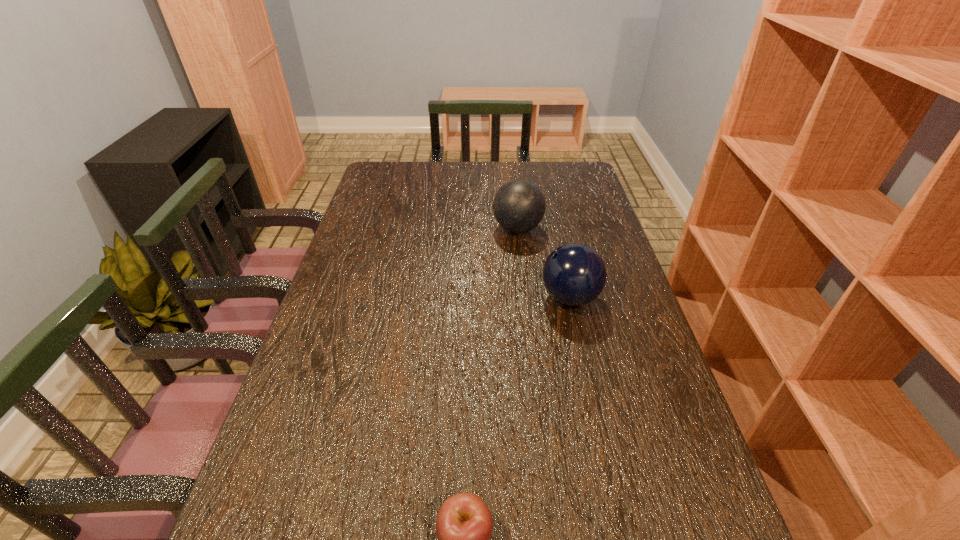
The height and width of the screenshot is (540, 960). I want to click on the farthest object, so click(x=519, y=205).

Locate an element on the screen. the nearer bowling ball is located at coordinates (574, 274).

Where is `free region located 0.260m on the grip area of the farther bowling ball`? free region located 0.260m on the grip area of the farther bowling ball is located at coordinates (414, 228).

Where is `vacant region located 0.120m on the grip area of the farther bowling ball`? The width and height of the screenshot is (960, 540). vacant region located 0.120m on the grip area of the farther bowling ball is located at coordinates (456, 228).

The height and width of the screenshot is (540, 960). What are the coordinates of `vacant space located 0.130m on the grip area of the farther bowling ball` in the screenshot? It's located at (453, 228).

Where is `free location located on the surface of the second nearest object near the finger holes`? The width and height of the screenshot is (960, 540). free location located on the surface of the second nearest object near the finger holes is located at coordinates (397, 298).

The image size is (960, 540). Find the location of `vacant space located 0.290m on the surface of the second nearest object near the finger holes`. vacant space located 0.290m on the surface of the second nearest object near the finger holes is located at coordinates (434, 298).

Where is `vacant space located 0.370m on the surface of the second nearest object near the finger holes`? The image size is (960, 540). vacant space located 0.370m on the surface of the second nearest object near the finger holes is located at coordinates (405, 298).

Find the location of `object that is at the right edge`. object that is at the right edge is located at coordinates (574, 274).

In the image, there is a desktop. Where is `free space at the far edge`? The image size is (960, 540). free space at the far edge is located at coordinates (485, 161).